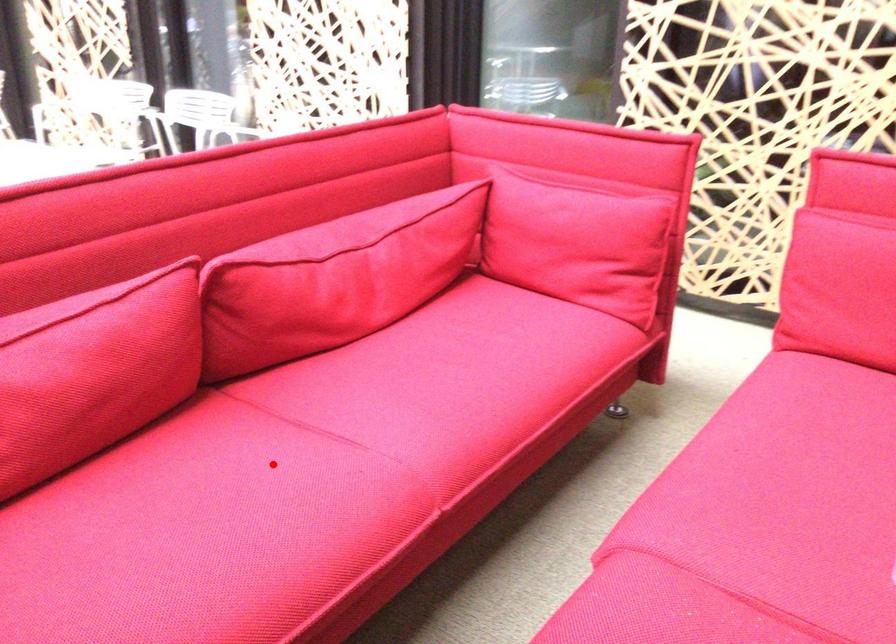
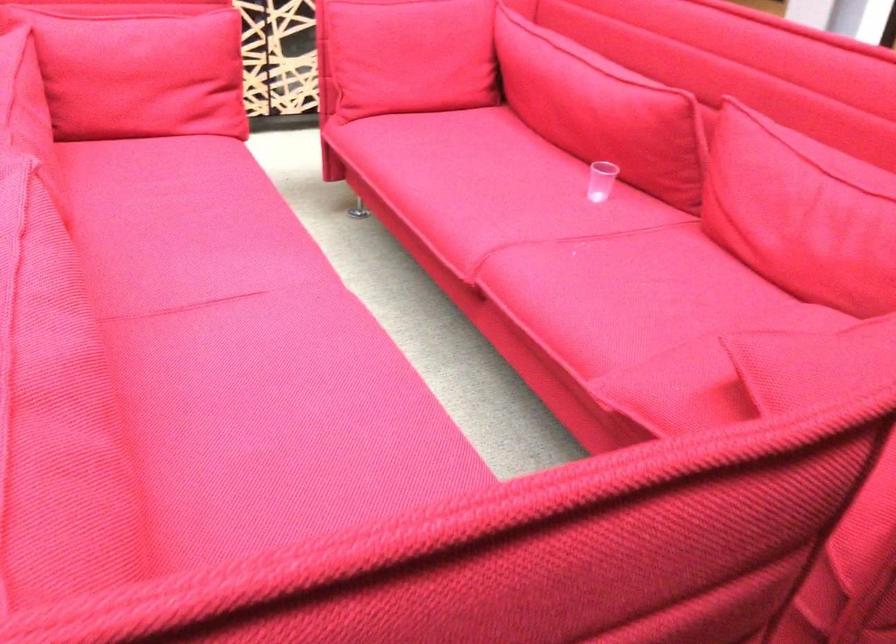
Question: I am providing you with two images of the same scene from different viewpoints. A red point is marked on the first image. At the location where the point appears in image 1, is it still visible in image 2?

Choices:
 (A) Yes
 (B) No

Answer: (A)